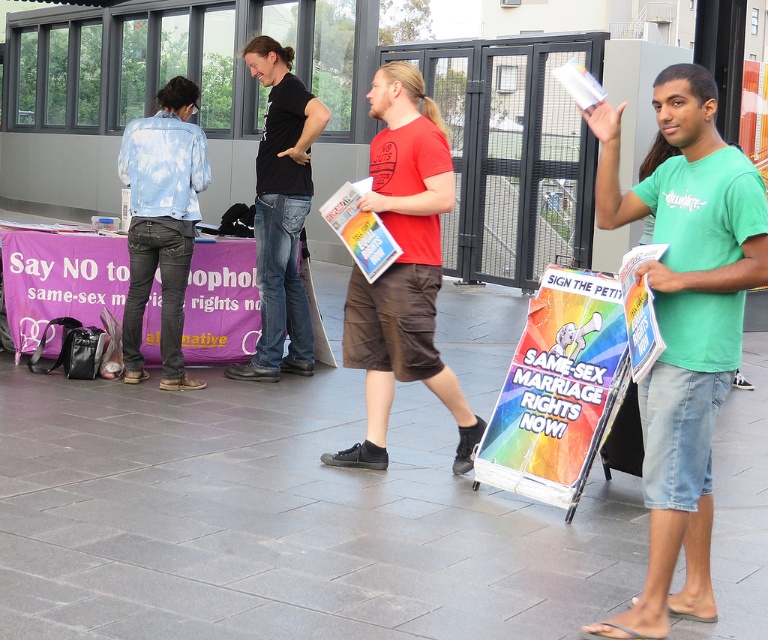
You are a passerby who wants to read both the rainbow paper sign at center and the matte paper poster at right. Which one should you look at first if you want to start from the one that is positioned higher up?

You should look at the matte paper poster at right first because the rainbow paper sign at center is located below it, meaning the matte paper poster at right is higher up.